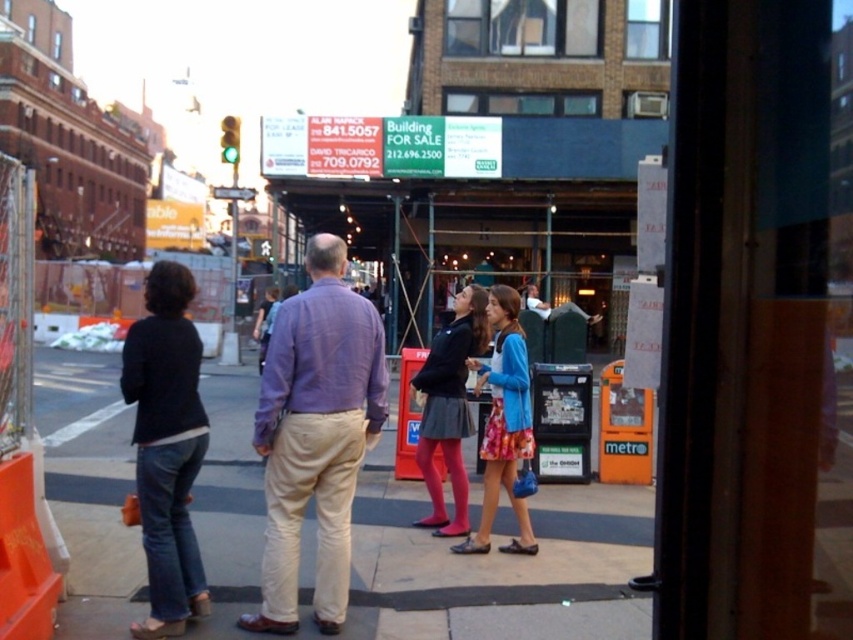
Between denim jeans at left and floral fabric dress at center, which one is positioned lower?

floral fabric dress at center is lower down.

Who is more distant from viewer, (171,397) or (498,477)?

Positioned behind is point (498,477).

Which is behind, point (190, 611) or point (508, 365)?

Point (508, 365)

This screenshot has height=640, width=853. I want to click on denim jeans at left, so click(166, 445).

Is point (361, 394) positioned behind point (135, 416)?

No.

Between point (291, 419) and point (155, 515), which one is positioned in front?

Positioned in front is point (155, 515).

I want to click on purple cotton shirt at center, so click(x=315, y=435).

Does smooth concrete sidewalk at center have a lesser height compared to denim jeans at left?

In fact, smooth concrete sidewalk at center may be taller than denim jeans at left.

In the scene shown: Who is taller, smooth concrete sidewalk at center or denim jeans at left?

A: Standing taller between the two is smooth concrete sidewalk at center.

Which is in front, point (497, 621) or point (189, 419)?

Positioned in front is point (189, 419).

This screenshot has width=853, height=640. Find the location of `smooth concrete sidewalk at center`. smooth concrete sidewalk at center is located at coordinates (498, 564).